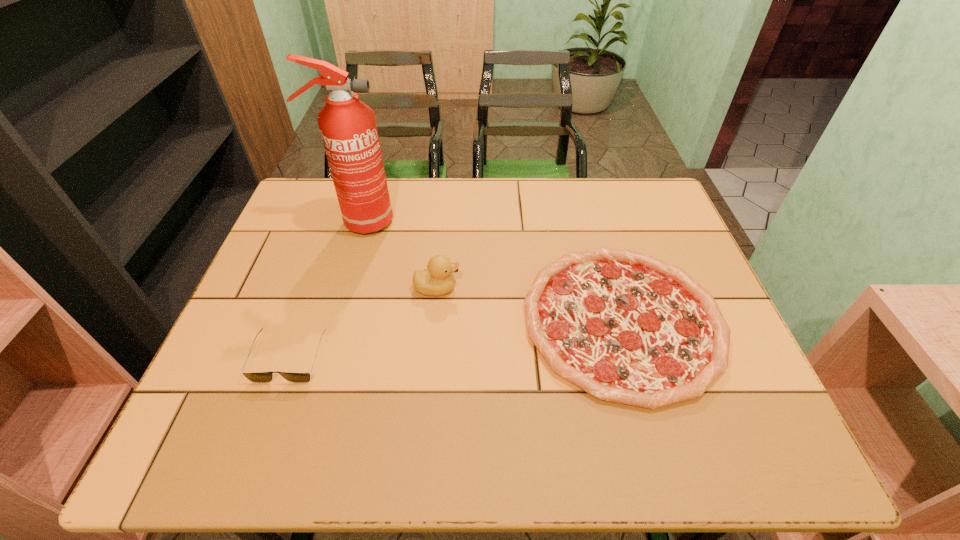
At what (x,y) coordinates should I click in order to perform the action: click on vacant space at the near left corner. Please return your answer as a coordinate pair (x, y). This screenshot has height=540, width=960. Looking at the image, I should click on click(x=248, y=423).

Image resolution: width=960 pixels, height=540 pixels. In the image, there is a desktop. In order to click on blank space at the far right corner in this screenshot , I will do `click(666, 222)`.

Find the location of `vacant region between the shortest object and the second shortest object`. vacant region between the shortest object and the second shortest object is located at coordinates click(x=456, y=339).

At what (x,y) coordinates should I click in order to perform the action: click on free space between the shortest object and the fire extinguisher. Please return your answer as a coordinate pair (x, y). Image resolution: width=960 pixels, height=540 pixels. Looking at the image, I should click on (491, 271).

Identify the location of vacant space that's between the tallest object and the pizza. Image resolution: width=960 pixels, height=540 pixels. (491, 271).

The height and width of the screenshot is (540, 960). What are the coordinates of `free space that is in between the farthest object and the pizza` in the screenshot? It's located at (491, 271).

At what (x,y) coordinates should I click in order to perform the action: click on free space between the second shortest object and the fire extinguisher. Please return your answer as a coordinate pair (x, y). This screenshot has width=960, height=540. Looking at the image, I should click on click(324, 290).

Find the location of a particular element. This screenshot has height=540, width=960. vacant space that's between the pizza and the farthest object is located at coordinates (491, 271).

Identify the location of empty space between the third shortest object and the tallest object. (398, 255).

Image resolution: width=960 pixels, height=540 pixels. In order to click on vacant area between the rightmost object and the farthest object in this screenshot , I will do `click(491, 271)`.